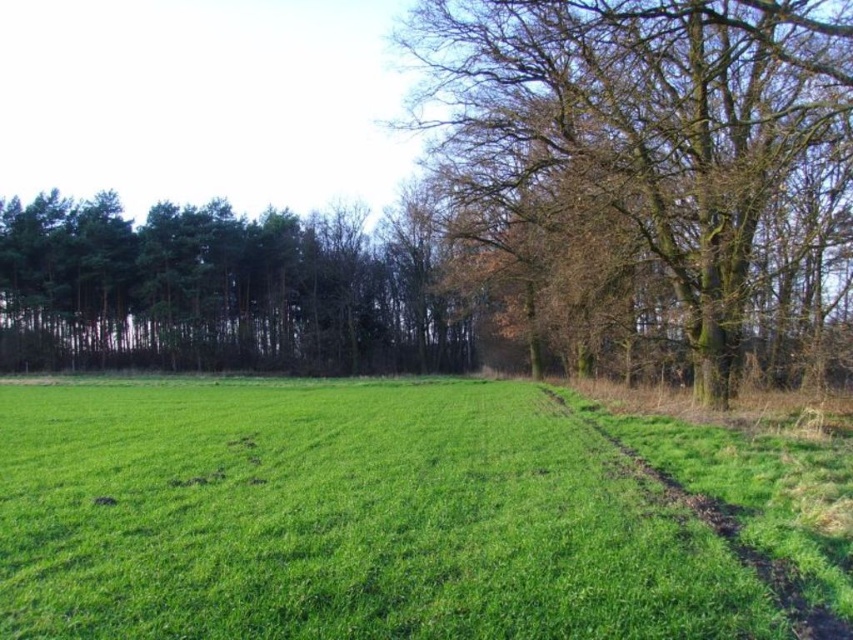
Consider the image. You are a drone operator trying to capture a specific tree in the rural landscape. The scene has a green field with a curving path and a cluster of trees on the right. You need to locate the brown rough bark tree at upper right. According to the coordinates provided, where exactly should you position your drone to capture this tree?

The brown rough bark tree at upper right is located at the 2D coordinates point (634, 131), so the drone should be positioned there to capture it.